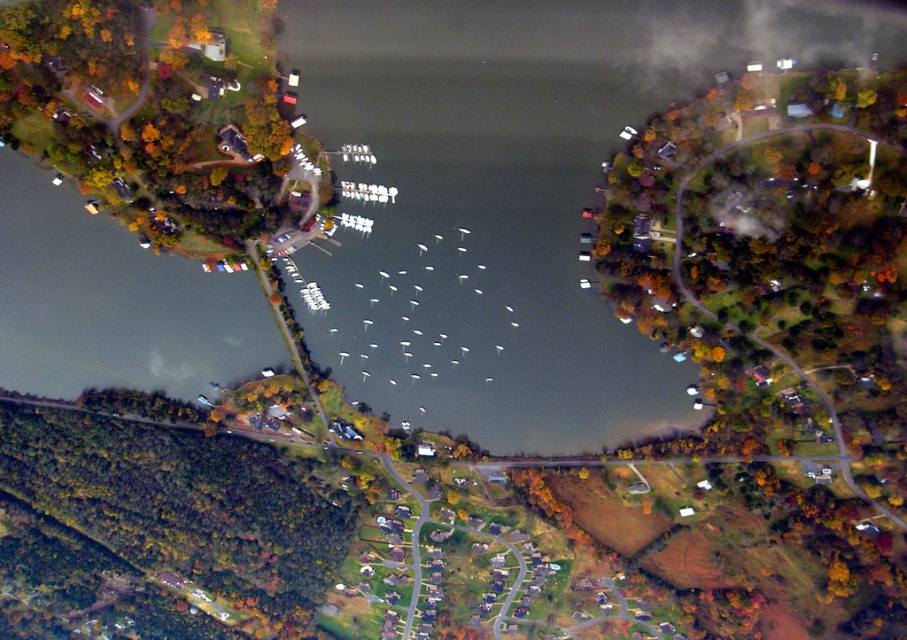
Is green leafy trees at center positioned before green leafy trees at lower left?

Yes, green leafy trees at center is in front of green leafy trees at lower left.

Which is more to the right, green leafy trees at center or green leafy trees at lower left?

From the viewer's perspective, green leafy trees at center appears more on the right side.

The image size is (907, 640). Identify the location of green leafy trees at center. (783, 320).